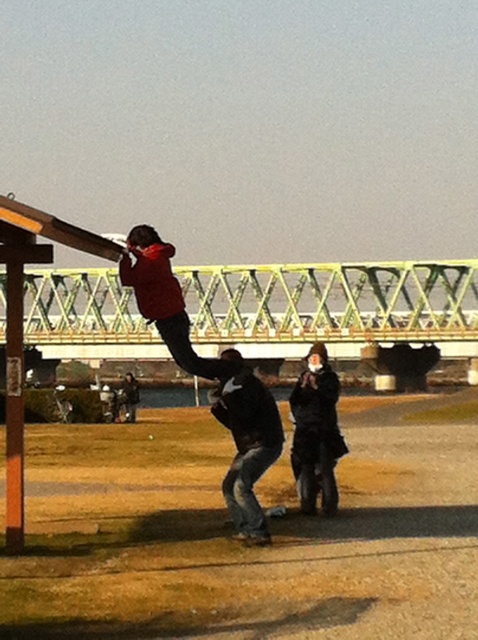
Question: Can you confirm if dark gray jeans at center is positioned below matte red jacket at center?

Choices:
 (A) no
 (B) yes

Answer: (B)

Question: Which object appears farthest from the camera in this image?

Choices:
 (A) black fur coat at center
 (B) dark gray jeans at center

Answer: (A)

Question: Can you confirm if dark gray jeans at center is wider than black fur coat at center?

Choices:
 (A) yes
 (B) no

Answer: (A)

Question: Which is farther from the dark gray jeans at center?

Choices:
 (A) matte red jacket at center
 (B) black fur coat at center

Answer: (B)

Question: Which point is closer to the camera taking this photo?

Choices:
 (A) (324, 464)
 (B) (271, 417)
 (C) (159, 260)

Answer: (C)

Question: In this image, where is dark gray jeans at center located relative to black fur coat at center?

Choices:
 (A) left
 (B) right

Answer: (A)